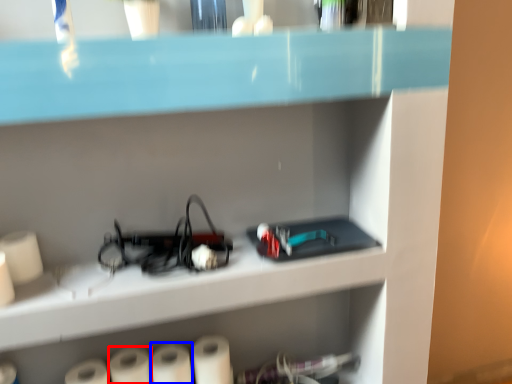
Question: Which object is closer to the camera taking this photo, paper towel (highlighted by a red box) or paper towel (highlighted by a blue box)?

Choices:
 (A) paper towel
 (B) paper towel

Answer: (A)